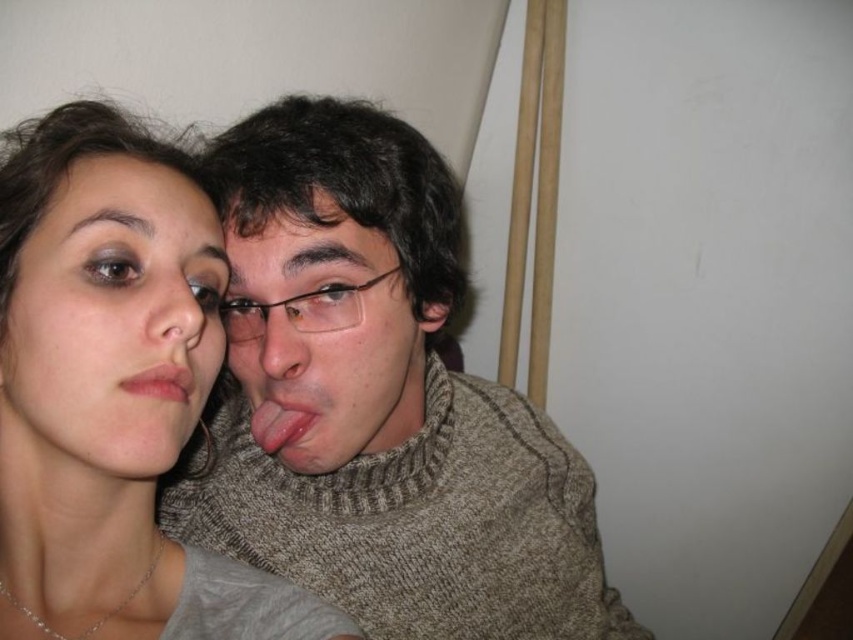
Question: Which object appears closest to the camera in this image?

Choices:
 (A) pink matte lips at center
 (B) matte brown sweater at center

Answer: (A)

Question: Where is matte gray shirt at upper left located in relation to matte brown sweater at center in the image?

Choices:
 (A) left
 (B) right

Answer: (A)

Question: Is knitted sweater at center wider than pink matte lips at center?

Choices:
 (A) yes
 (B) no

Answer: (A)

Question: Which object is the farthest from the matte gray shirt at upper left?

Choices:
 (A) matte brown sweater at center
 (B) matte skin face at left
 (C) pink glossy tongue at center
 (D) pink matte lips at center

Answer: (C)

Question: Based on their relative distances, which object is farther from the matte brown sweater at center?

Choices:
 (A) knitted sweater at center
 (B) pink glossy tongue at center
 (C) pink matte lips at center

Answer: (C)

Question: Can you confirm if matte skin face at left is thinner than pink glossy tongue at center?

Choices:
 (A) yes
 (B) no

Answer: (B)